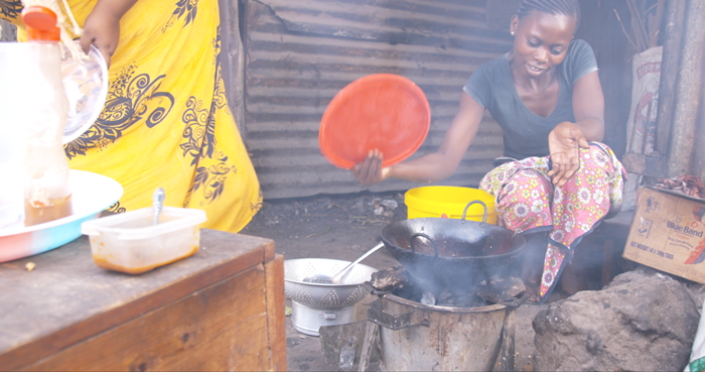
Find the location of a particular element. This screenshot has width=705, height=372. cardboard box is located at coordinates (675, 235).